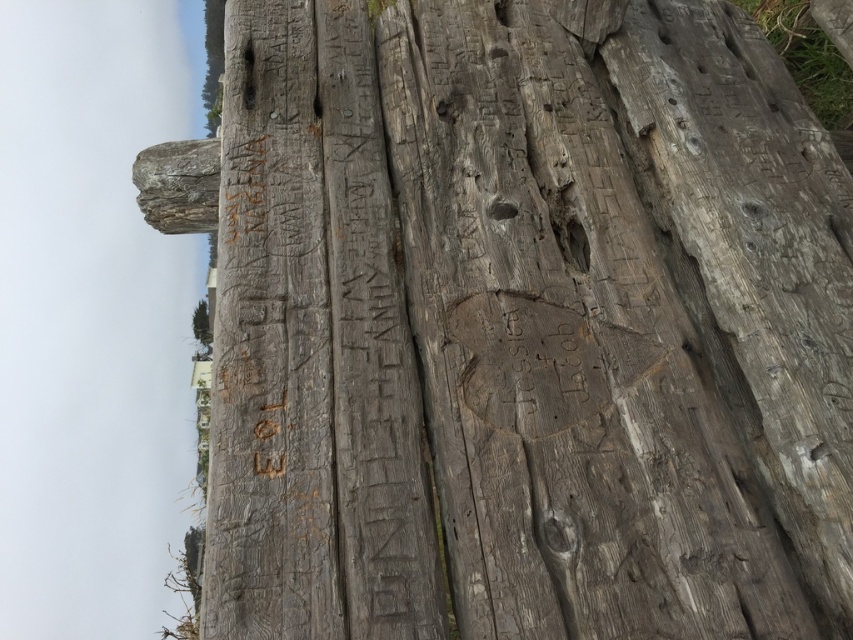
Which of these two, smooth gray tree trunk at upper center or green leafy tree at upper left, stands taller?

smooth gray tree trunk at upper center

Can you confirm if smooth gray tree trunk at upper center is positioned to the left of green leafy tree at upper left?

In fact, smooth gray tree trunk at upper center is to the right of green leafy tree at upper left.

Locate an element on the screen. This screenshot has width=853, height=640. smooth gray tree trunk at upper center is located at coordinates (213, 61).